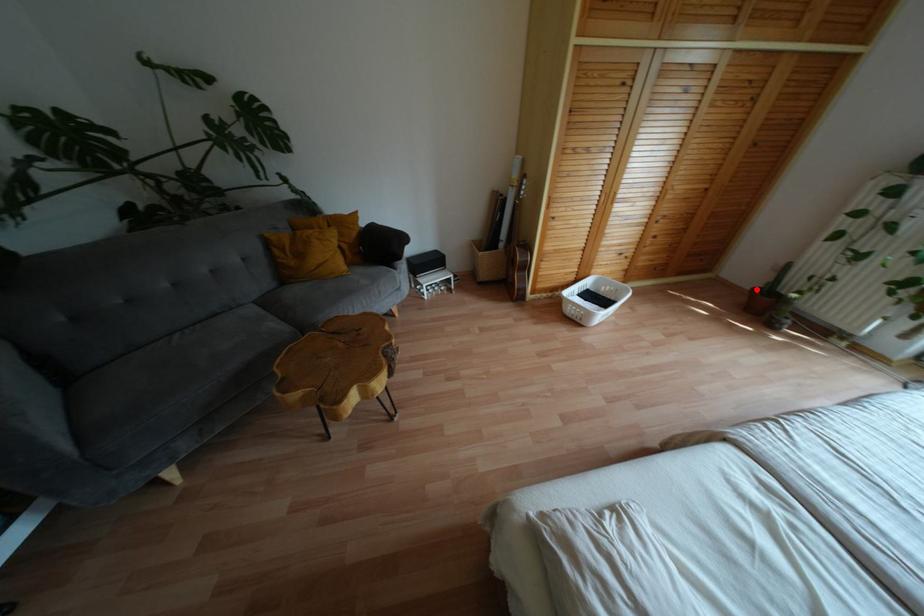
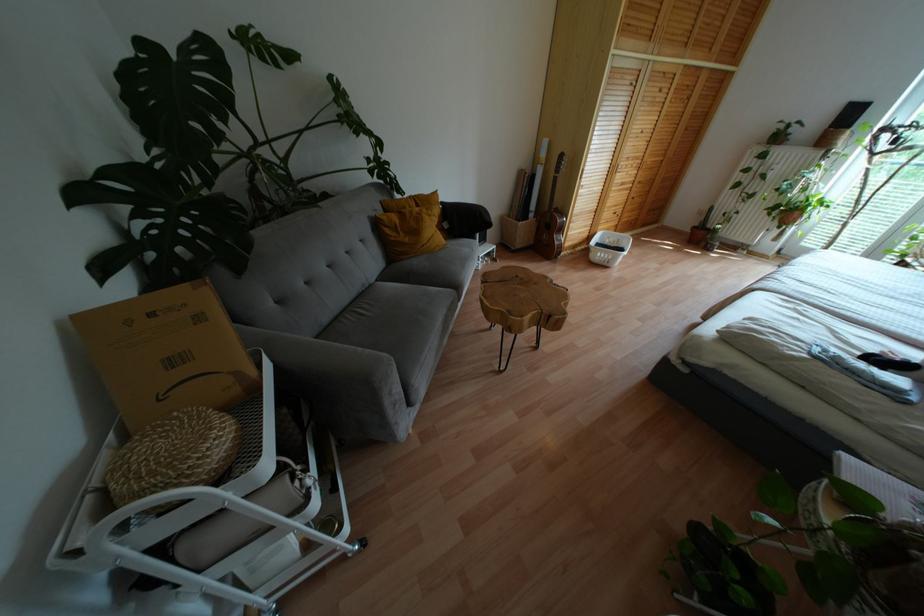
Question: I am providing you with two images of the same scene from different viewpoints. A red point is shown in image1. For the corresponding object point in image2, is it positioned nearer or farther from the camera?

Choices:
 (A) Nearer
 (B) Farther

Answer: (A)